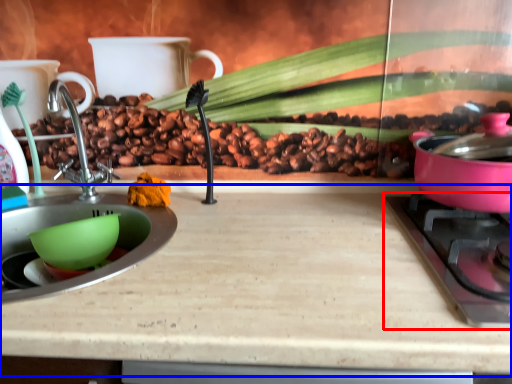
Question: Which object appears closest to the camera in this image, gas stove (highlighted by a red box) or counter top (highlighted by a blue box)?

Choices:
 (A) gas stove
 (B) counter top

Answer: (B)